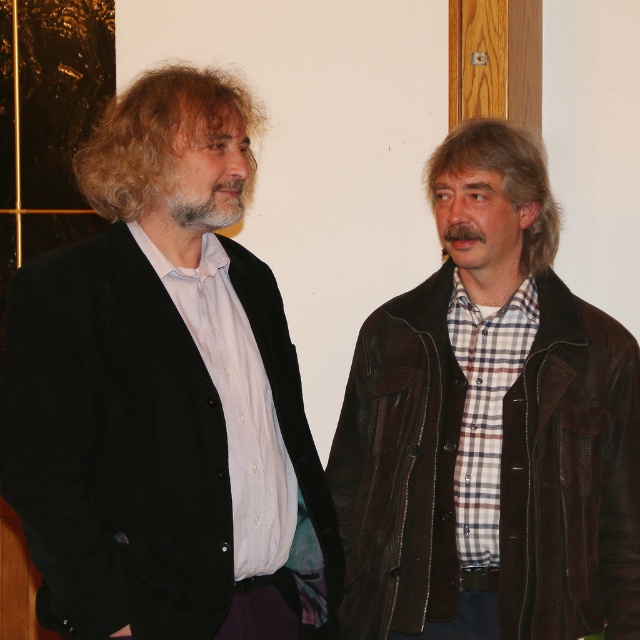
Can you confirm if black velvet jacket at left is smaller than graywoollybeard at center?

No.

Who is taller, black velvet jacket at left or graywoollybeard at center?

With more height is black velvet jacket at left.

What are the coordinates of `black velvet jacket at left` in the screenshot? It's located at (156, 388).

The width and height of the screenshot is (640, 640). What are the coordinates of `black velvet jacket at left` in the screenshot? It's located at (156, 388).

Does black velvet jacket at left come behind brown leather jacket at right?

No, black velvet jacket at left is in front of brown leather jacket at right.

Between black velvet jacket at left and brown leather jacket at right, which one is positioned higher?

black velvet jacket at left is higher up.

This screenshot has width=640, height=640. What do you see at coordinates (156, 388) in the screenshot?
I see `black velvet jacket at left` at bounding box center [156, 388].

Identify the location of black velvet jacket at left. (156, 388).

Is brown leather jacket at right bigger than graywoollybeard at center?

Yes.

Who is positioned more to the left, brown leather jacket at right or graywoollybeard at center?

graywoollybeard at center

Locate an element on the screen. The width and height of the screenshot is (640, 640). brown leather jacket at right is located at coordinates (490, 428).

Find the location of a particular element. brown leather jacket at right is located at coordinates (490, 428).